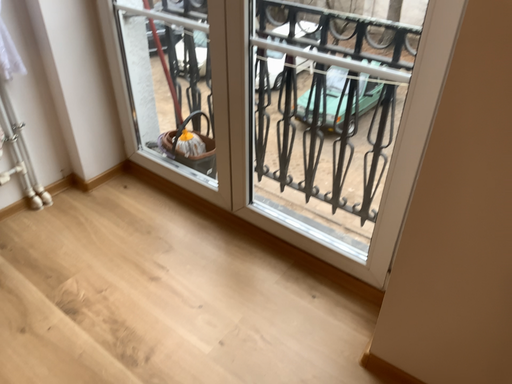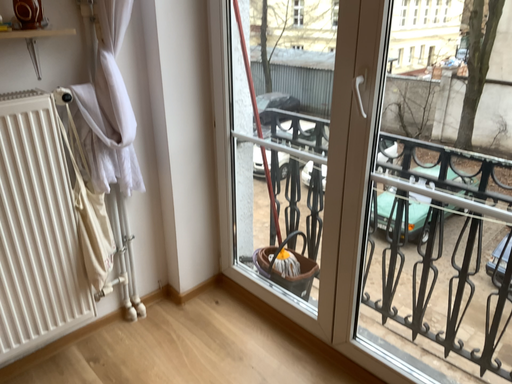
Question: How did the camera likely rotate when shooting the video?

Choices:
 (A) rotated right
 (B) rotated left

Answer: (B)